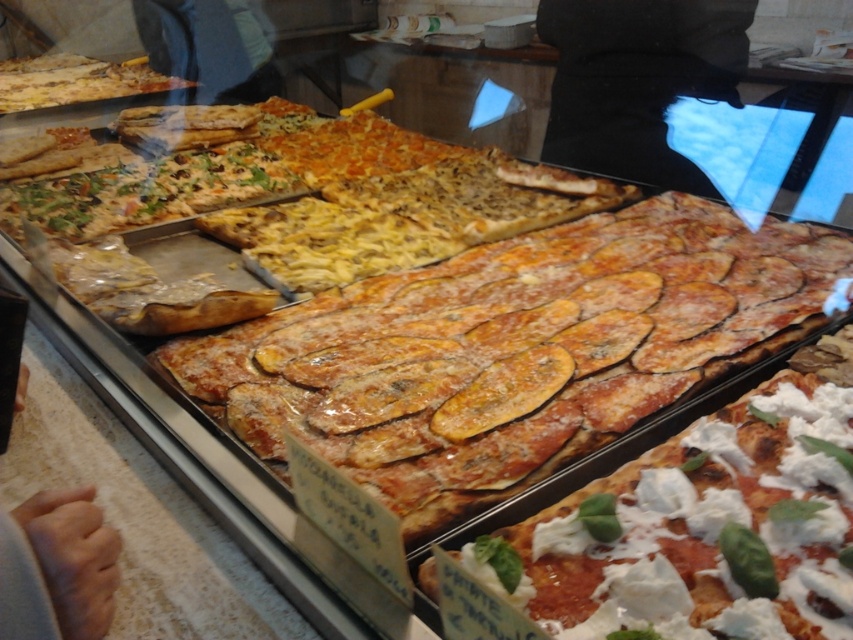
Can you confirm if white creamy cheese at center is shorter than golden brown crust at upper left?

Yes, white creamy cheese at center is shorter than golden brown crust at upper left.

Between white creamy cheese at center and golden brown crust at upper left, which one has more height?

golden brown crust at upper left

The height and width of the screenshot is (640, 853). What do you see at coordinates (691, 532) in the screenshot?
I see `white creamy cheese at center` at bounding box center [691, 532].

At what (x,y) coordinates should I click in order to perform the action: click on white creamy cheese at center. Please return your answer as a coordinate pair (x, y). The height and width of the screenshot is (640, 853). Looking at the image, I should click on (691, 532).